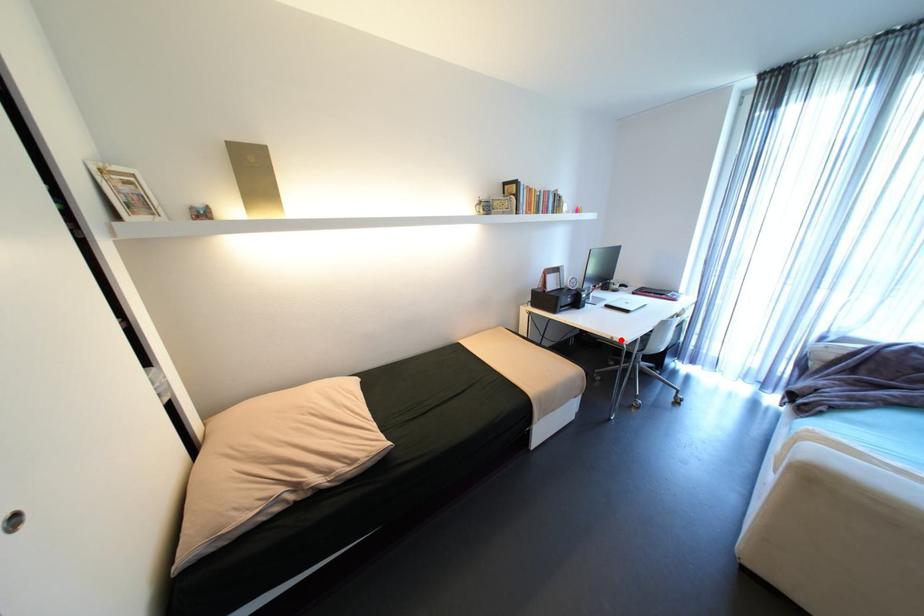
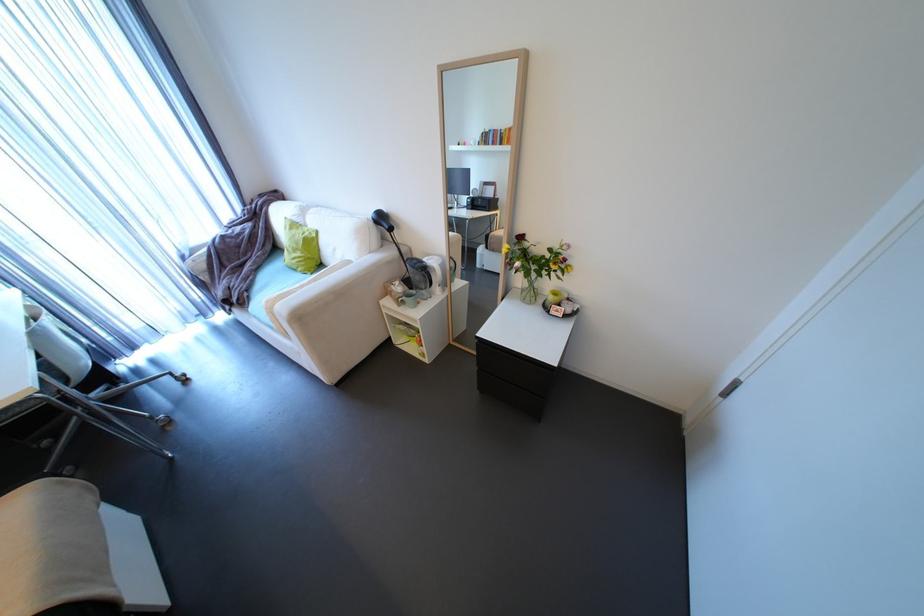
Question: A red point is marked in image1. In image2, is the corresponding 3D point closer to the camera or farther? Reply with the corresponding letter.

Choices:
 (A) The corresponding 3D point is closer.
 (B) The corresponding 3D point is farther.

Answer: (B)